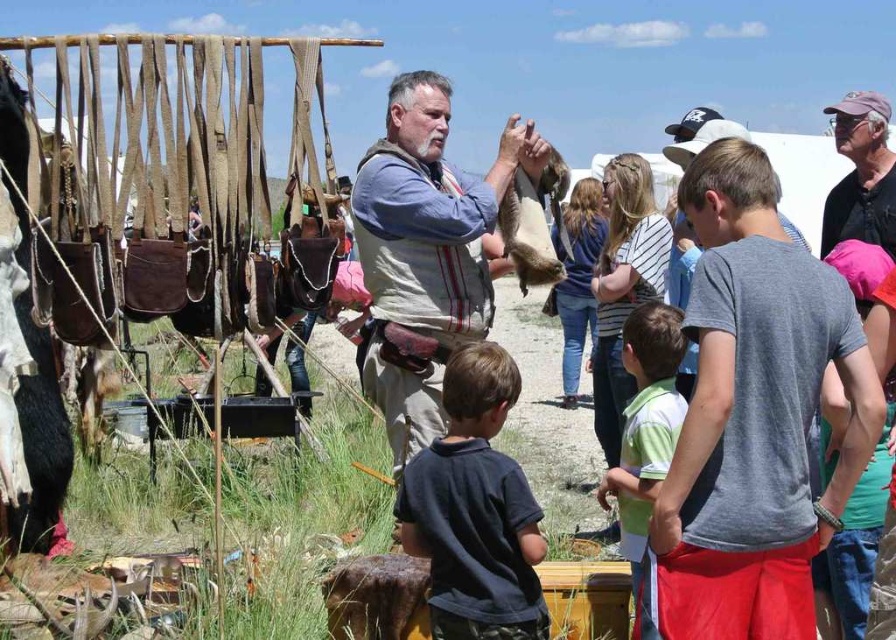
You are an observer at the event. You notice two clothing items worn by the man. The brown leather vest at center and the dark blue cotton shirt at lower center. Which clothing item is taller?

The brown leather vest at center is taller than the dark blue cotton shirt at lower center.

You are a participant in the event and want to take a photo of the man holding the animal hide. You are standing at point (479, 304). Is there any obstruction between you and the man at point (650, 376)?

Point (479, 304) is behind point (650, 376), so there is an obstruction between you and the man at point (650, 376). You might need to move to a different position to get a clear shot.